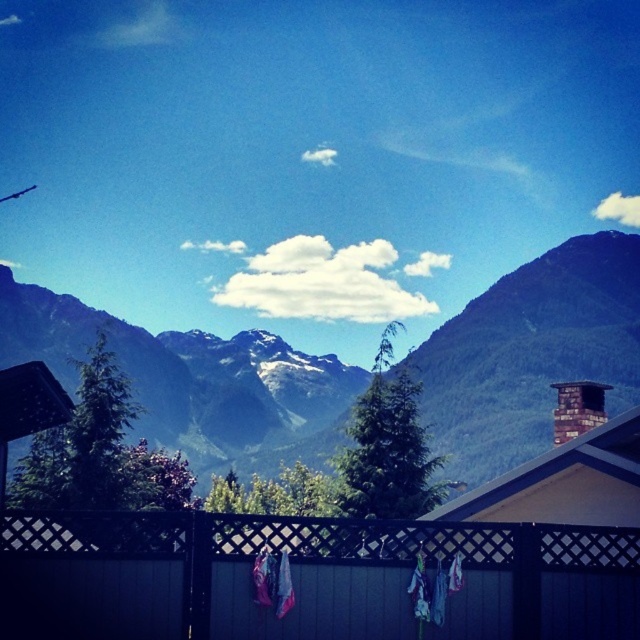
You are standing in the middle of the scene and want to take a photo of the brick chimney at upper right without the black wood fence at center blocking the view. Which direction should you move to ensure the fence is out of frame?

You should move to the right side of the scene because the black wood fence at center is to the left of the brick chimney at upper right. By moving right, you can position yourself so the fence no longer blocks the chimney.

You are standing in the serene outdoor scene with the mountainous landscape. There is a wooden fence with a lattice design in the foreground. Where is the point located at coordinates (x=308, y=577) in relation to the black wood fence at center?

The point at coordinates (x=308, y=577) indicates the location of the black wood fence at center.